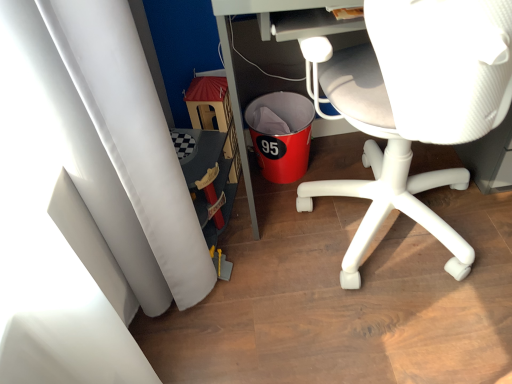
Where is `free location in front of white plastic chair at right`? free location in front of white plastic chair at right is located at coordinates (412, 331).